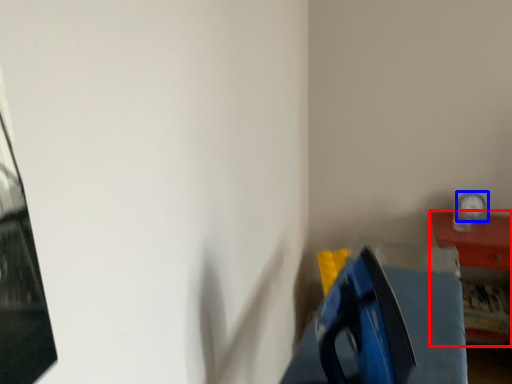
Question: Among these objects, which one is farthest to the camera, furniture (highlighted by a red box) or clock (highlighted by a blue box)?

Choices:
 (A) furniture
 (B) clock

Answer: (B)